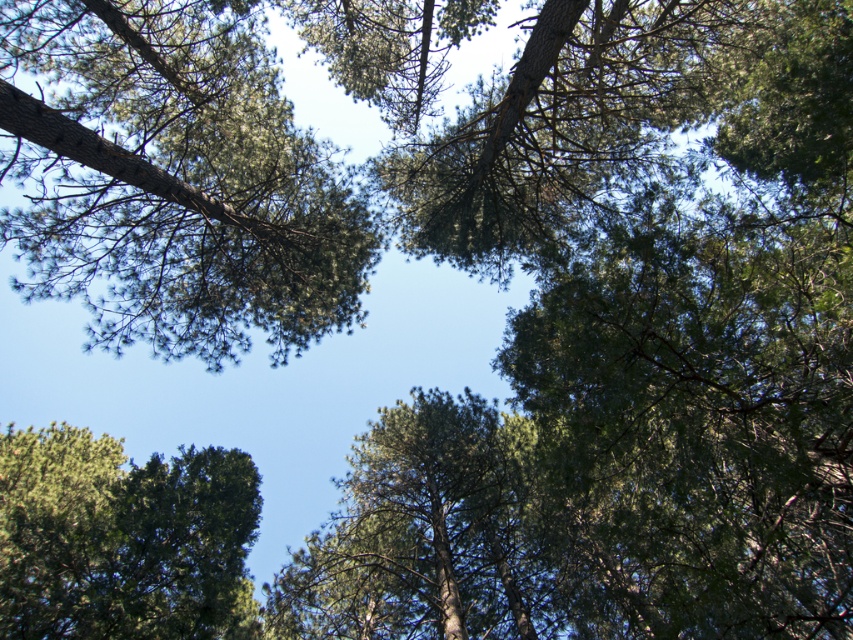
Question: Does green textured tree at upper left have a smaller size compared to green textured tree at lower left?

Choices:
 (A) no
 (B) yes

Answer: (B)

Question: Which object is closer to the camera taking this photo?

Choices:
 (A) green textured tree at upper left
 (B) green textured tree at lower left

Answer: (B)

Question: Is green textured tree at upper left to the left of green textured tree at lower left from the viewer's perspective?

Choices:
 (A) yes
 (B) no

Answer: (B)

Question: Observing the image, what is the correct spatial positioning of green textured tree at upper left in reference to green textured tree at lower left?

Choices:
 (A) left
 (B) right

Answer: (B)